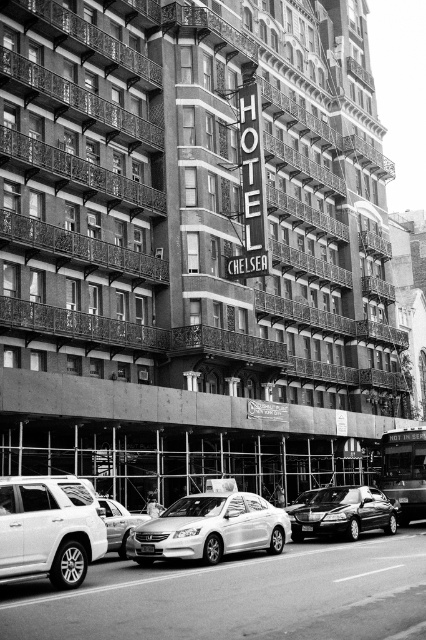
Question: Is matte silver suv at lower left thinner than shiny silver sedan at center?

Choices:
 (A) yes
 (B) no

Answer: (A)

Question: Considering the real-world distances, which object is farthest from the shiny black sedan at center?

Choices:
 (A) matte silver suv at lower left
 (B) silver metallic sedan at center
 (C) shiny silver sedan at center

Answer: (A)

Question: Which is nearer to the matte silver suv at lower left?

Choices:
 (A) silver metallic sedan at center
 (B) shiny silver sedan at center
 (C) shiny black sedan at center

Answer: (B)

Question: Based on their relative distances, which object is farther from the silver metallic sedan at center?

Choices:
 (A) shiny silver sedan at center
 (B) matte silver suv at lower left
 (C) shiny black sedan at center

Answer: (C)

Question: Is matte silver suv at lower left to the left of shiny silver sedan at center from the viewer's perspective?

Choices:
 (A) no
 (B) yes

Answer: (B)

Question: Is shiny black sedan at center above silver metallic sedan at center?

Choices:
 (A) yes
 (B) no

Answer: (A)